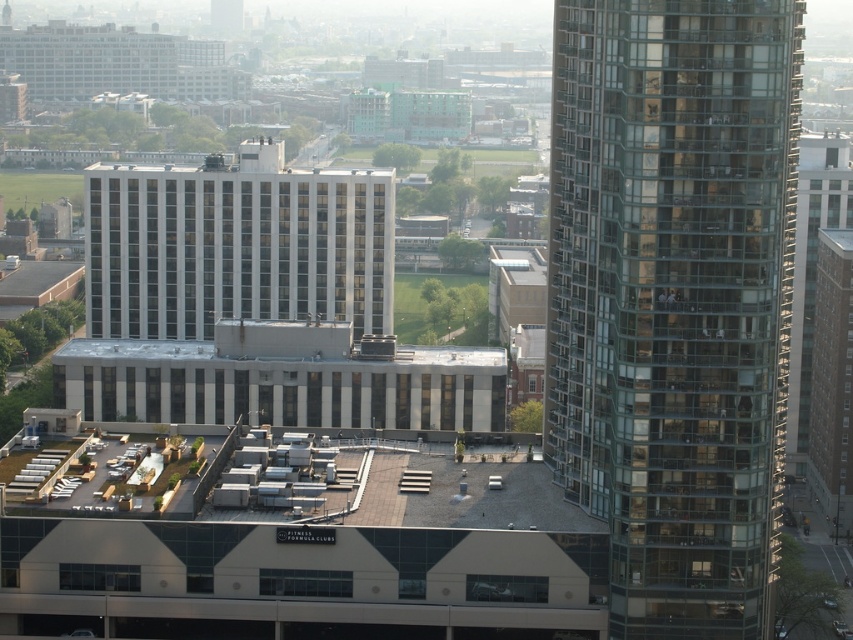
Can you confirm if transparent glass building at right is bigger than white matte building at center?

No.

Which is behind, point (628, 394) or point (196, 273)?

The point (196, 273) is behind.

Between point (769, 356) and point (366, 289), which one is positioned behind?

Point (366, 289)

Identify the location of transparent glass building at right. (674, 298).